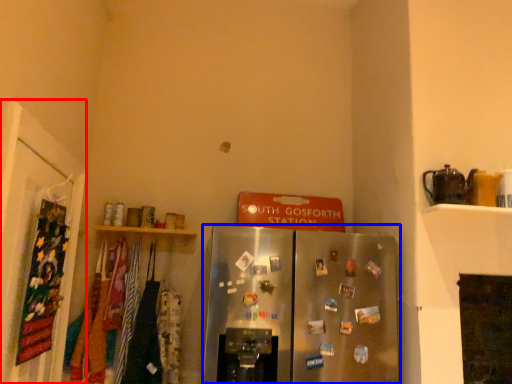
Question: Which object is further to the camera taking this photo, door (highlighted by a red box) or refrigerator (highlighted by a blue box)?

Choices:
 (A) door
 (B) refrigerator

Answer: (B)